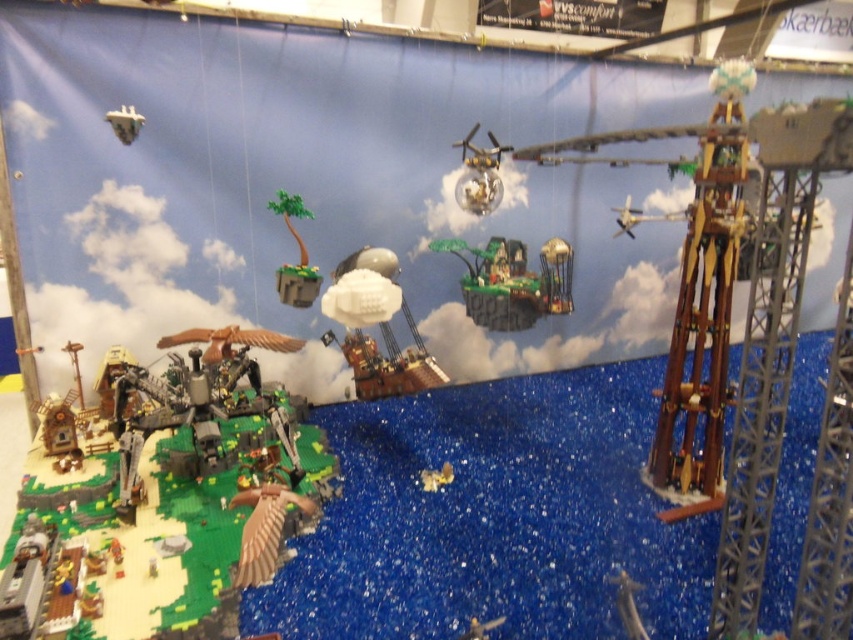
You are a character in the Lego diorama who needs to reach the green matte tree at center. However, there is a transparent plastic sphere at upper center blocking your path. Can you move around it to reach the tree?

The transparent plastic sphere at upper center is positioned over the green matte tree at center, so you can move around it to reach the tree since it is above and not directly in front.

You are a character in this Lego diorama who wants to travel from the wooden tower at right to the white matte airship at center. Which direction should you move to reach your destination?

The wooden tower at right is located above the white matte airship at center, so to reach the airship, you should move downward from the tower.